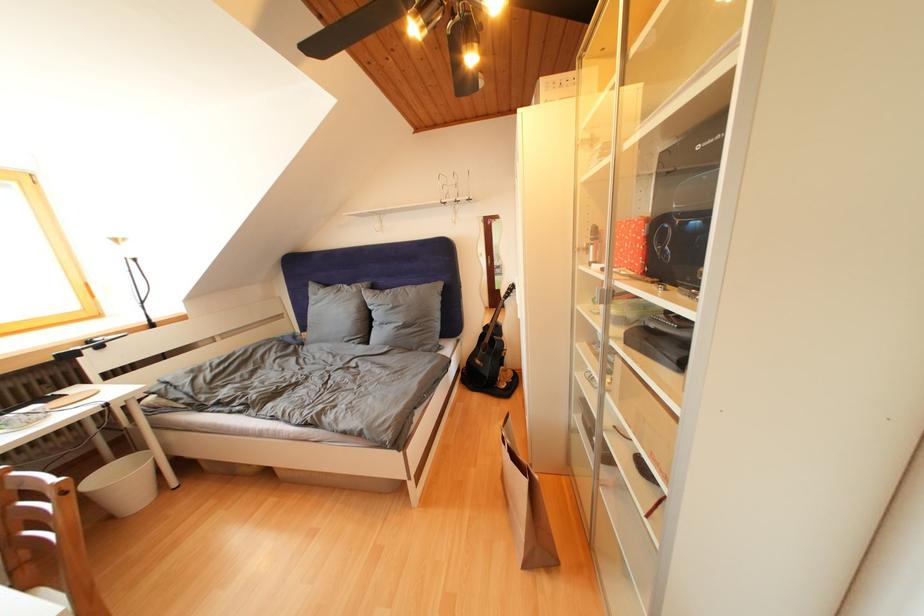
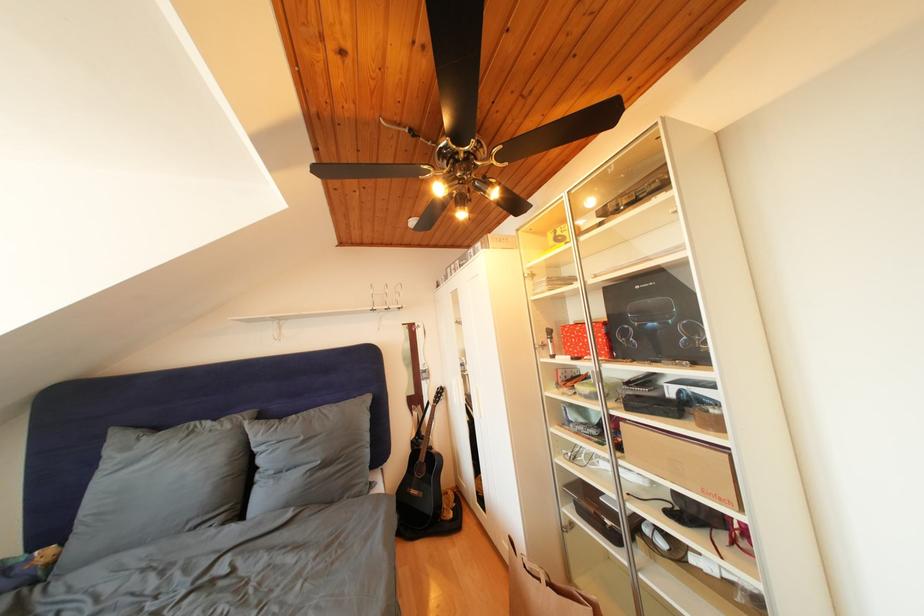
Where in the second image is the point corresponding to point 362,294 from the first image?

(236, 432)